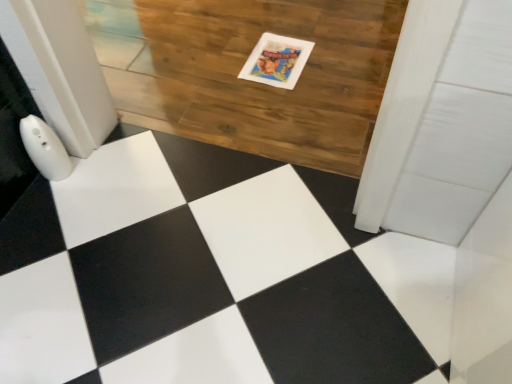
In order to click on blank space above wooden floor at center (from a real-world perspective) in this screenshot , I will do `click(239, 71)`.